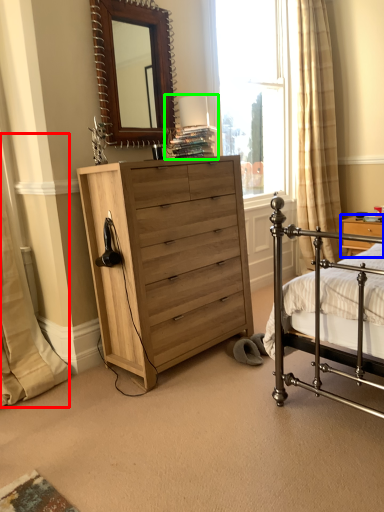
Question: Which object is positioned closest to curtain (highlighted by a red box)? Select from nightstand (highlighted by a blue box) and table lamp (highlighted by a green box).

Choices:
 (A) nightstand
 (B) table lamp

Answer: (B)